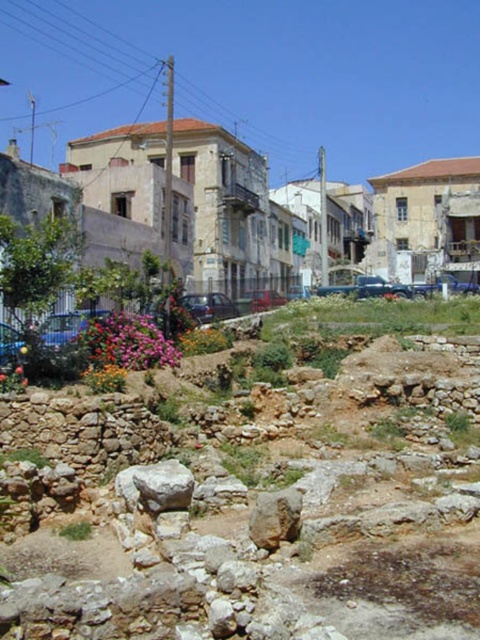
You are an archaeologist examining the stone remains in the image. You notice the brown rough stone at lower center and the brown rough rock at center. Which one is positioned higher up in the image?

The brown rough stone at lower center is located above the brown rough rock at center, so it is positioned higher up in the image.

You are standing in the archaeological site and want to move from point A to point B. Point A is at coordinates point (232, 515) and point B is at coordinates point (286, 492). Which point is closer to you when you are facing the scene?

Point (232, 515) is closer to you because it is further to the viewer than point (286, 492), meaning it is positioned nearer in the scene.

You are an archaeologist examining the stone remains in the image. You have a measuring tape and need to determine which object is taller between the brown rough stone at lower center and the brown rough rock at center. Based on the scene, can you identify which one is taller?

The brown rough stone at lower center is much taller than the brown rough rock at center, so the brown rough stone at lower center is the taller one.